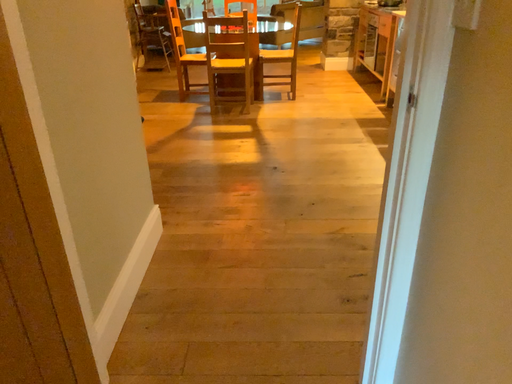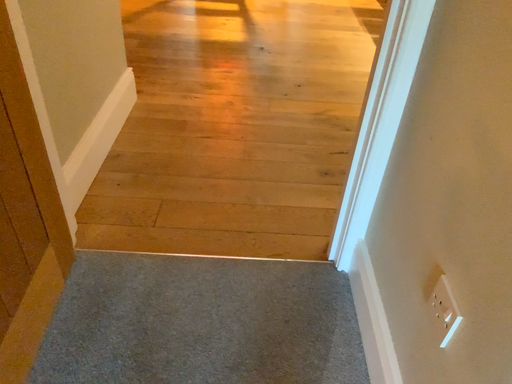
Question: Which way did the camera rotate in the video?

Choices:
 (A) rotated downward
 (B) rotated upward

Answer: (A)